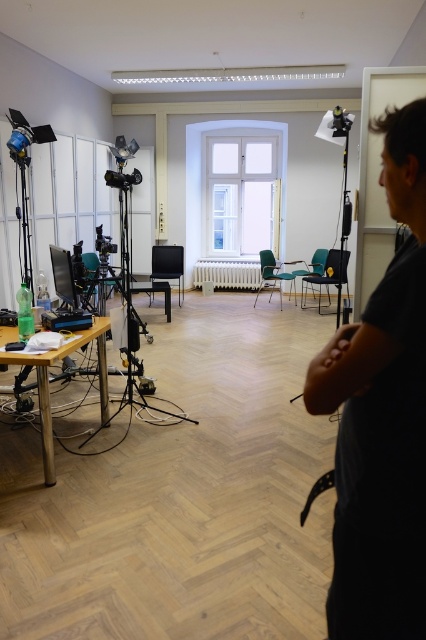
You are standing in the studio and want to place a new piece of equipment at the center of the room. Considering the black matte shirt at right is currently occupying space at point 0.653, 0.897, will placing the equipment at the center interfere with the shirt?

The black matte shirt at right is located at point (382, 417), which is not the center of the room. Placing the equipment at the center will not interfere with the shirt.